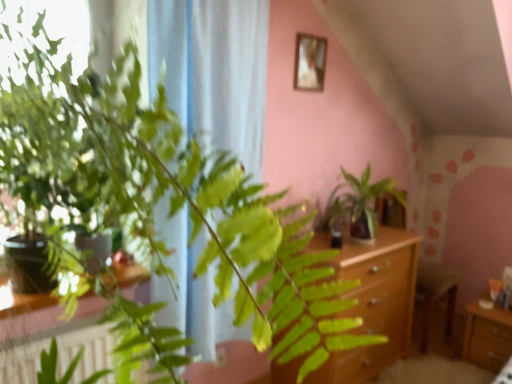
Question: Is white sheer curtain at left wider or thinner than wooden drawer at lower right?

Choices:
 (A) thin
 (B) wide

Answer: (A)

Question: Considering their positions, is white sheer curtain at left located in front of or behind wooden drawer at lower right?

Choices:
 (A) front
 (B) behind

Answer: (A)

Question: Which object is positioned closest to the green glossy plant at center?

Choices:
 (A) wooden drawer at lower right
 (B) white sheer curtain at left
 (C) light brown wooden dresser at center
 (D) wooden frame at upper center

Answer: (C)

Question: Which object is the closest to the green glossy plant at center?

Choices:
 (A) light brown wooden dresser at center
 (B) wooden frame at upper center
 (C) wooden drawer at lower right
 (D) white sheer curtain at left

Answer: (A)